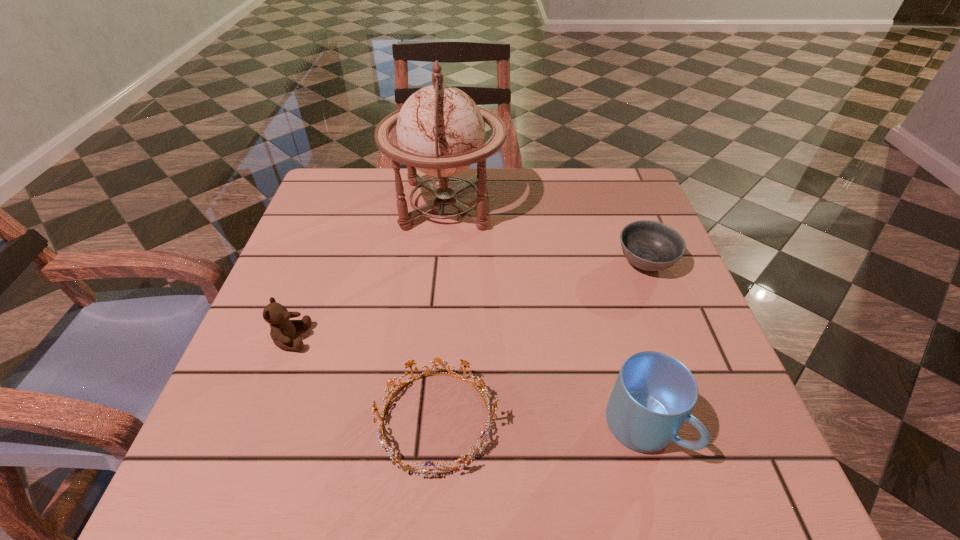
Identify the location of vacant space located 0.280m on the front-facing side of the tiara. (670, 420).

Find the location of a particular element. object that is at the far edge is located at coordinates (440, 130).

Identify the location of mug present at the near edge. This screenshot has height=540, width=960. [654, 394].

Identify the location of tiara that is at the near edge. (463, 461).

The image size is (960, 540). I want to click on object at the left edge, so [x=283, y=330].

Locate an element on the screen. This screenshot has width=960, height=540. mug present at the right edge is located at coordinates (654, 394).

The height and width of the screenshot is (540, 960). I want to click on bowl located in the right edge section of the desktop, so click(649, 245).

You are a GUI agent. You are given a task and a screenshot of the screen. Output one action in this format:
    pyautogui.click(x=<x>, y=<y>)
    Task: Click on the object located at the near right corner
    The image size is (960, 540).
    Given the screenshot: What is the action you would take?
    pyautogui.click(x=654, y=394)

The height and width of the screenshot is (540, 960). Find the location of `vacant point at the far edge`. vacant point at the far edge is located at coordinates (508, 195).

Identify the location of vacant area at the near edge of the desktop. The width and height of the screenshot is (960, 540). (493, 489).